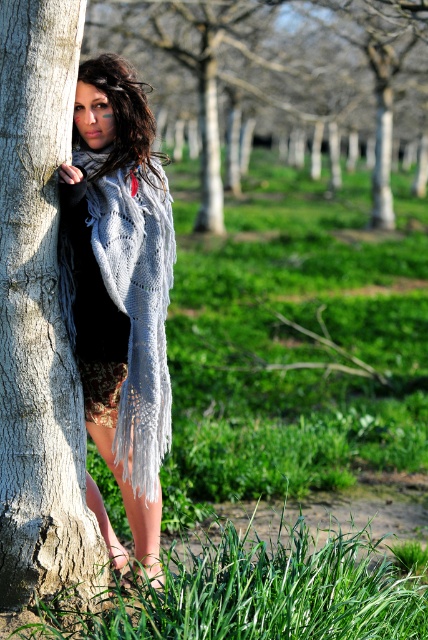
Question: Does smooth gray bark at left appear on the left side of knitted wool shawl at left?

Choices:
 (A) no
 (B) yes

Answer: (B)

Question: Which point is closer to the camera taking this photo?

Choices:
 (A) (101, 516)
 (B) (80, 557)
 (C) (202, 100)

Answer: (B)

Question: Can you confirm if knitted wool shawl at left is wider than dark brown hair at left?

Choices:
 (A) yes
 (B) no

Answer: (A)

Question: Which of these objects is positioned farthest from the knitted wool shawl at left?

Choices:
 (A) smooth gray tree trunk at left
 (B) dark brown hair at left

Answer: (A)

Question: Is knitted wool shawl at left thinner than dark brown hair at left?

Choices:
 (A) no
 (B) yes

Answer: (A)

Question: Which point is closer to the camera?

Choices:
 (A) knitted wool shawl at left
 (B) smooth gray tree trunk at left

Answer: (A)